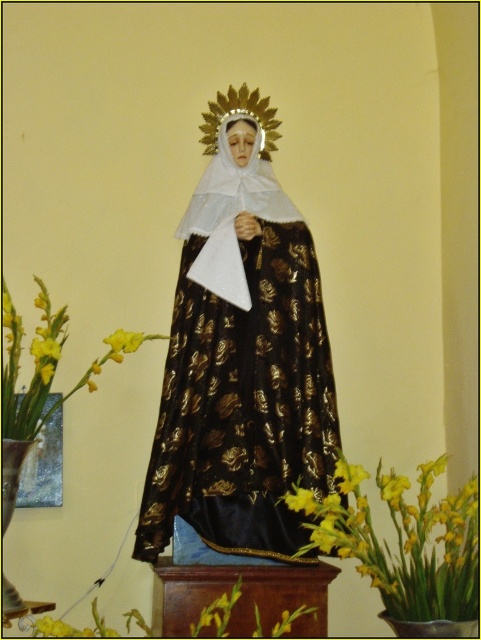
You are a tour guide explaining the statue and the flowers to visitors. You want to mention the distance between the shiny gold fabric statue at center and the yellow matte flower at lower center. How far apart are they?

The shiny gold fabric statue at center and the yellow matte flower at lower center are 18.51 inches apart from each other.

Looking at this image, you are standing in front of the statue and want to place a small offering between the yellow matte flower at center and the yellow matte flower at lower center. Which flower should you place the offering closer to if you want it to be to the right of the lower flower?

You should place the offering closer to the yellow matte flower at center because it is positioned on the right side of the yellow matte flower at lower center.